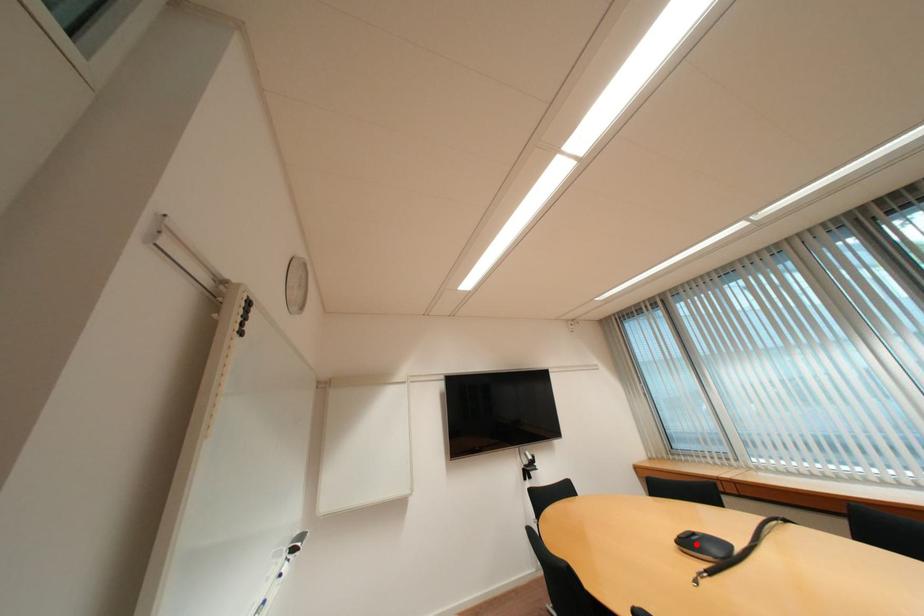
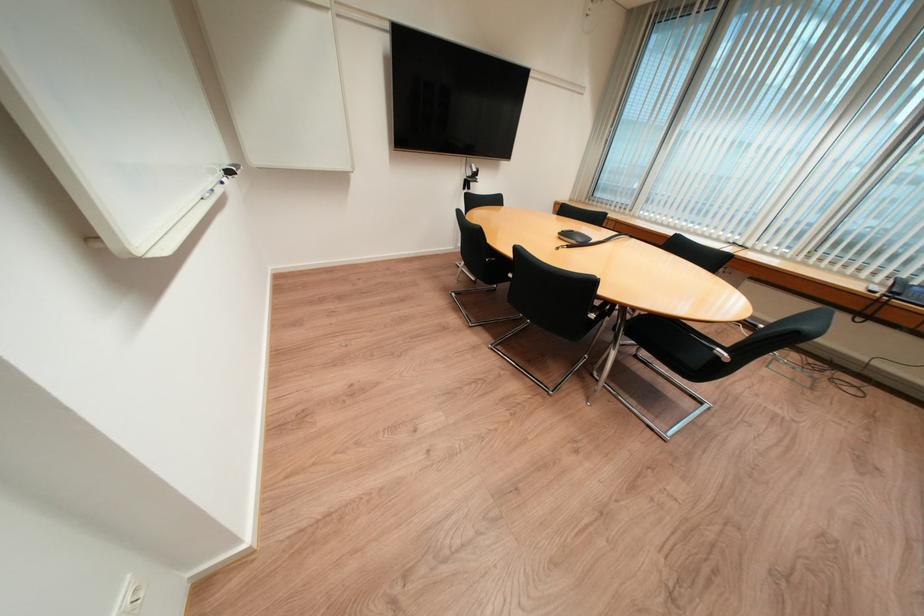
The point at the highlighted location is marked in the first image. Where is the corresponding point in the second image?

(574, 236)